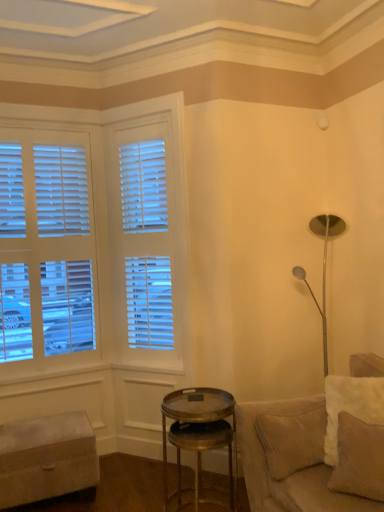
Question: Is beige fabric pillow at lower right far from beige leather couch at lower right?

Choices:
 (A) yes
 (B) no

Answer: (B)

Question: Can you confirm if beige fabric pillow at lower right is taller than beige leather couch at lower right?

Choices:
 (A) yes
 (B) no

Answer: (B)

Question: Can you confirm if beige fabric pillow at lower right is thinner than beige leather couch at lower right?

Choices:
 (A) yes
 (B) no

Answer: (A)

Question: From the image's perspective, is beige fabric pillow at lower right located above beige leather couch at lower right?

Choices:
 (A) no
 (B) yes

Answer: (B)

Question: Considering the relative sizes of beige fabric pillow at lower right and beige leather couch at lower right in the image provided, is beige fabric pillow at lower right wider than beige leather couch at lower right?

Choices:
 (A) yes
 (B) no

Answer: (B)

Question: Does beige fabric pillow at lower right have a larger size compared to beige leather couch at lower right?

Choices:
 (A) yes
 (B) no

Answer: (B)

Question: Is the position of beige fabric ottoman at lower left more distant than that of beige fabric pillow at lower right?

Choices:
 (A) no
 (B) yes

Answer: (B)

Question: From the image's perspective, does beige fabric ottoman at lower left appear higher than beige fabric pillow at lower right?

Choices:
 (A) yes
 (B) no

Answer: (B)

Question: Does beige fabric ottoman at lower left have a greater height compared to beige fabric pillow at lower right?

Choices:
 (A) no
 (B) yes

Answer: (A)

Question: Is beige fabric ottoman at lower left oriented away from beige fabric pillow at lower right?

Choices:
 (A) yes
 (B) no

Answer: (B)

Question: Can beige fabric pillow at lower right be found inside beige fabric ottoman at lower left?

Choices:
 (A) no
 (B) yes

Answer: (A)

Question: Is beige fabric ottoman at lower left bigger than beige fabric pillow at lower right?

Choices:
 (A) no
 (B) yes

Answer: (B)

Question: Is beige leather couch at lower right bigger than beige fabric pillow at lower right?

Choices:
 (A) no
 (B) yes

Answer: (B)